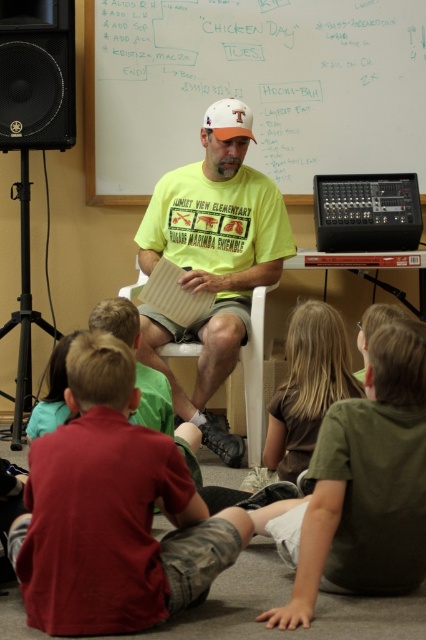
Does green cotton shirt at lower right have a larger size compared to yellow t-shirt at center?

No.

I want to click on green cotton shirt at lower right, so click(x=360, y=486).

Image resolution: width=426 pixels, height=640 pixels. What do you see at coordinates (360, 486) in the screenshot? I see `green cotton shirt at lower right` at bounding box center [360, 486].

I want to click on green cotton shirt at lower right, so click(x=360, y=486).

Who is positioned more to the right, whiteboard at upper center or black matte speaker at upper left?

From the viewer's perspective, whiteboard at upper center appears more on the right side.

Looking at this image, how distant is whiteboard at upper center from black matte speaker at upper left?

whiteboard at upper center is 29.39 inches from black matte speaker at upper left.

Between point (313, 20) and point (54, 116), which one is positioned behind?

The point (313, 20) is more distant.

What are the coordinates of `whiteboard at upper center` in the screenshot? It's located at (253, 88).

Can you confirm if green cotton shirt at lower right is wider than brown smooth shirt at lower center?

Indeed, green cotton shirt at lower right has a greater width compared to brown smooth shirt at lower center.

Can you confirm if green cotton shirt at lower right is positioned to the left of brown smooth shirt at lower center?

In fact, green cotton shirt at lower right is to the right of brown smooth shirt at lower center.

You are a GUI agent. You are given a task and a screenshot of the screen. Output one action in this format:
    pyautogui.click(x=<x>, y=<y>)
    Task: Click on the green cotton shirt at lower right
    This screenshot has width=426, height=640.
    Given the screenshot: What is the action you would take?
    pyautogui.click(x=360, y=486)

I want to click on green cotton shirt at lower right, so click(360, 486).